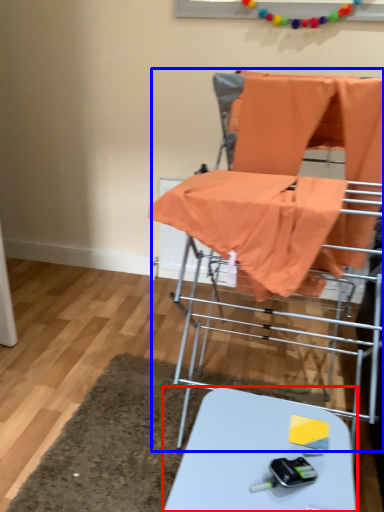
Question: Which object appears closest to the camera in this image, table (highlighted by a red box) or baby carriage (highlighted by a blue box)?

Choices:
 (A) table
 (B) baby carriage

Answer: (A)